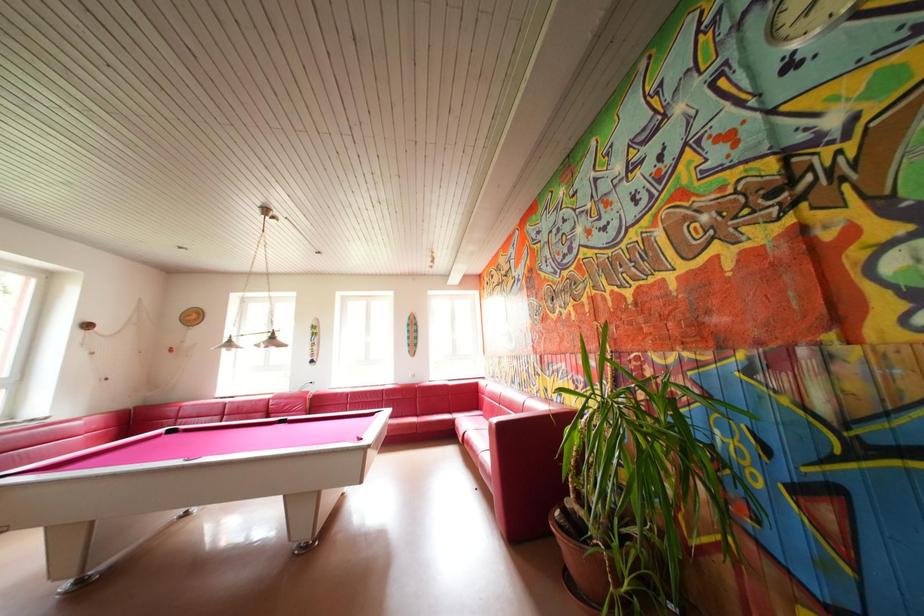
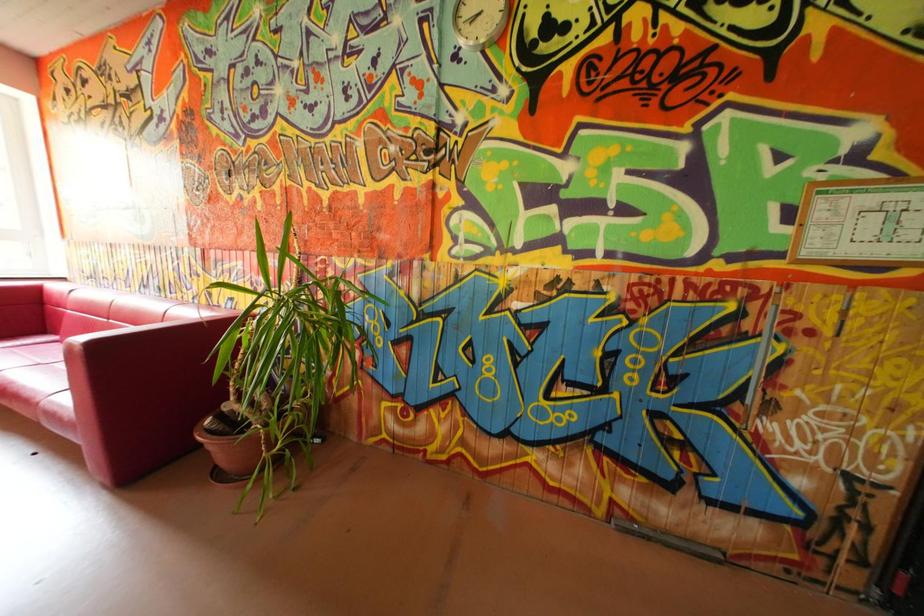
Question: The first image is from the beginning of the video and the second image is from the end. How did the camera likely rotate when shooting the video?

Choices:
 (A) Left
 (B) Right
 (C) Up
 (D) Down

Answer: (B)